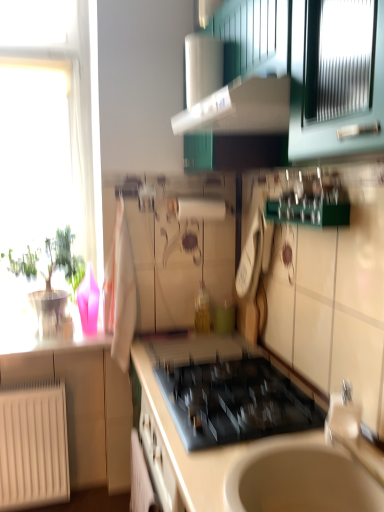
Locate an element on the screen. The height and width of the screenshot is (512, 384). white glossy exhaust hood at upper center is located at coordinates (240, 109).

What is the approximate width of white glossy exhaust hood at upper center?

The width of white glossy exhaust hood at upper center is 18.67 inches.

Where is `white glossy paper towel dispenser at upper center`? This screenshot has width=384, height=512. white glossy paper towel dispenser at upper center is located at coordinates (202, 67).

Identify the location of white matte radiator at lower left. This screenshot has width=384, height=512. (33, 445).

I want to click on white glossy countertop at center, so click(x=239, y=433).

The width and height of the screenshot is (384, 512). Describe the element at coordinates (200, 209) in the screenshot. I see `white matte paper towel at center` at that location.

Locate an element on the screen. The height and width of the screenshot is (512, 384). white glossy exhaust hood at upper center is located at coordinates (240, 109).

Is beige ceramic sink at lower right oriented towards white matte radiator at lower left?

No, beige ceramic sink at lower right is not aimed at white matte radiator at lower left.

Between point (267, 490) and point (57, 490), which one is positioned behind?

The point (57, 490) is more distant.

Can you tell me how much beige ceramic sink at lower right and white matte radiator at lower left differ in facing direction?

90.5 degrees separate the facing orientations of beige ceramic sink at lower right and white matte radiator at lower left.

Between beige ceramic sink at lower right and white matte radiator at lower left, which one has larger size?

With larger size is white matte radiator at lower left.

Is white glossy countertop at center to the left or to the right of green glossy plant at left in the image?

Clearly, white glossy countertop at center is on the right of green glossy plant at left in the image.

From the image's perspective, is white glossy countertop at center located above green glossy plant at left?

No, from the image's perspective, white glossy countertop at center is not on top of green glossy plant at left.

Which of these two, white glossy countertop at center or green glossy plant at left, is smaller?

green glossy plant at left is smaller.

Looking at this image, from their relative heights in the image, would you say white glossy countertop at center is taller or shorter than green glossy plant at left?

Considering their sizes, white glossy countertop at center has more height than green glossy plant at left.

Between silver metallic faucet at lower right and beige ceramic sink at lower right, which one has more height?

With more height is silver metallic faucet at lower right.

Is silver metallic faucet at lower right in front of or behind beige ceramic sink at lower right in the image?

Visually, silver metallic faucet at lower right is located behind beige ceramic sink at lower right.

Is silver metallic faucet at lower right facing towards beige ceramic sink at lower right?

Yes.

Measure the distance from silver metallic faucet at lower right to beige ceramic sink at lower right.

4.98 inches.

Which object is more forward, white matte radiator at lower left or white glossy exhaust hood at upper center?

Positioned in front is white glossy exhaust hood at upper center.

Are white matte radiator at lower left and white glossy exhaust hood at upper center located far from each other?

Yes, white matte radiator at lower left and white glossy exhaust hood at upper center are quite far apart.

From a real-world perspective, which is physically below, white matte radiator at lower left or white glossy exhaust hood at upper center?

In real-world perspective, white matte radiator at lower left is lower.

Does white matte radiator at lower left turn towards white glossy exhaust hood at upper center?

No.

Who is shorter, white matte radiator at lower left or transparent glass window at left?

white matte radiator at lower left is shorter.

Can you tell me how much white matte radiator at lower left and transparent glass window at left differ in facing direction?

There is a 0.55-degree angle between the facing directions of white matte radiator at lower left and transparent glass window at left.

From the image's perspective, between white matte radiator at lower left and transparent glass window at left, who is located below?

From the image's view, white matte radiator at lower left is below.

Is white matte radiator at lower left turned away from transparent glass window at left?

white matte radiator at lower left is not turned away from transparent glass window at left.

You are a GUI agent. You are given a task and a screenshot of the screen. Output one action in this format:
    pyautogui.click(x=<x>, y=<y>)
    Task: Click on the radiator on the left of white glossy countertop at center
    Image resolution: width=384 pixels, height=512 pixels.
    Given the screenshot: What is the action you would take?
    pyautogui.click(x=33, y=445)

Who is bigger, white matte radiator at lower left or white glossy countertop at center?

With larger size is white glossy countertop at center.

Considering the sizes of objects white matte radiator at lower left and white glossy countertop at center in the image provided, who is thinner, white matte radiator at lower left or white glossy countertop at center?

white matte radiator at lower left.

Does white matte radiator at lower left have a greater height compared to white glossy countertop at center?

No, white matte radiator at lower left is not taller than white glossy countertop at center.

Considering the points (62, 249) and (75, 179), which point is behind, point (62, 249) or point (75, 179)?

Positioned behind is point (75, 179).

Considering the relative sizes of green glossy plant at left and transparent glass window at left in the image provided, is green glossy plant at left smaller than transparent glass window at left?

Indeed, green glossy plant at left has a smaller size compared to transparent glass window at left.

This screenshot has width=384, height=512. What are the coordinates of `houseplant that is in front of the transparent glass window at left` in the screenshot? It's located at tap(51, 283).

Considering the relative sizes of green glossy plant at left and transparent glass window at left in the image provided, is green glossy plant at left wider than transparent glass window at left?

Yes.

What are the coordinates of `sink located on the right of white matte radiator at lower left` in the screenshot? It's located at (311, 471).

Image resolution: width=384 pixels, height=512 pixels. I want to click on countertop in front of the green glossy plant at left, so click(x=239, y=433).

Based on their spatial positions, is white glossy exhaust hood at upper center or transparent glass window at left closer to beige ceramic sink at lower right?

Based on the image, white glossy exhaust hood at upper center appears to be nearer to beige ceramic sink at lower right.

When comparing their distances from green glossy plant at left, does white matte paper towel at center or black glass gas stove at center seem further?

The object further to green glossy plant at left is black glass gas stove at center.

When comparing their distances from silver metallic faucet at lower right, does transparent glass window at left or white matte paper towel at center seem further?

transparent glass window at left.

From the image, which object appears to be nearer to beige ceramic sink at lower right, transparent glass window at left or white glossy exhaust hood at upper center?

The object closer to beige ceramic sink at lower right is white glossy exhaust hood at upper center.

Estimate the real-world distances between objects in this image. Which object is further from transparent glass window at left, black glass gas stove at center or white glossy paper towel dispenser at upper center?

black glass gas stove at center is further to transparent glass window at left.

Looking at this image, considering their positions, is white glossy countertop at center positioned closer to black glass gas stove at center than white matte radiator at lower left?

The object closer to black glass gas stove at center is white glossy countertop at center.

Looking at this image, estimate the real-world distances between objects in this image. Which object is further from beige ceramic sink at lower right, white matte radiator at lower left or green glossy plant at left?

white matte radiator at lower left is further to beige ceramic sink at lower right.

From the image, which object appears to be nearer to white matte radiator at lower left, silver metallic faucet at lower right or white glossy countertop at center?

white glossy countertop at center is positioned closer to the anchor white matte radiator at lower left.

What are the coordinates of `gas stove located between green glossy plant at left and silver metallic faucet at lower right in the left-right direction` in the screenshot? It's located at (234, 402).

Locate an element on the screen. paper towel between white glossy paper towel dispenser at upper center and silver metallic faucet at lower right in the vertical direction is located at coordinates (200, 209).

The height and width of the screenshot is (512, 384). Identify the location of faucet between white glossy exhaust hood at upper center and black glass gas stove at center in the up-down direction. (343, 415).

Where is `paper towel that lies between transparent glass window at left and white matte radiator at lower left from top to bottom`? The image size is (384, 512). paper towel that lies between transparent glass window at left and white matte radiator at lower left from top to bottom is located at coordinates (200, 209).